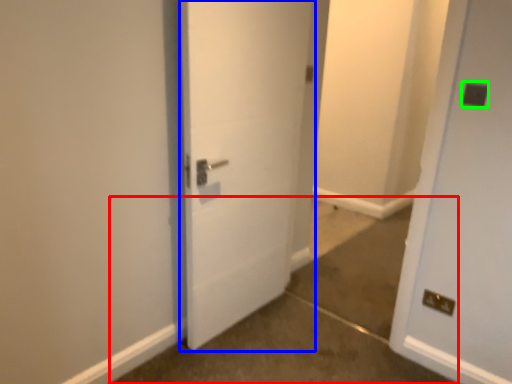
Question: Which is farther away from concrete (highlighted by a red box)? door (highlighted by a blue box) or electric outlet (highlighted by a green box)?

Choices:
 (A) door
 (B) electric outlet

Answer: (B)